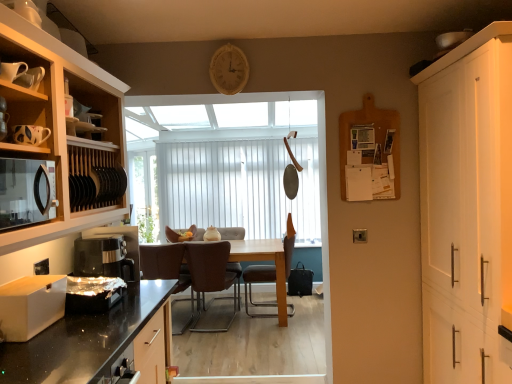
Question: From a real-world perspective, is black matte microwave at left on white vertical blinds at center?

Choices:
 (A) no
 (B) yes

Answer: (B)

Question: Does black matte microwave at left contain white vertical blinds at center?

Choices:
 (A) yes
 (B) no

Answer: (B)

Question: Can you confirm if black matte microwave at left is smaller than white vertical blinds at center?

Choices:
 (A) no
 (B) yes

Answer: (B)

Question: From the image's perspective, is black matte microwave at left beneath white vertical blinds at center?

Choices:
 (A) no
 (B) yes

Answer: (B)

Question: From the image's perspective, is black matte microwave at left above white vertical blinds at center?

Choices:
 (A) no
 (B) yes

Answer: (A)

Question: From a real-world perspective, is white vertical blinds at center above or below brown leather chair at center, arranged as the 3th chair when viewed from the right?

Choices:
 (A) below
 (B) above

Answer: (B)

Question: Is white vertical blinds at center taller or shorter than brown leather chair at center, arranged as the 3th chair when viewed from the right?

Choices:
 (A) short
 (B) tall

Answer: (B)

Question: Choose the correct answer: Is white vertical blinds at center inside brown leather chair at center, marked as the first chair in a left-to-right arrangement, or outside it?

Choices:
 (A) outside
 (B) inside

Answer: (A)

Question: In terms of size, does white vertical blinds at center appear bigger or smaller than brown leather chair at center, arranged as the 3th chair when viewed from the right?

Choices:
 (A) big
 (B) small

Answer: (A)

Question: In terms of size, does brown leather chair at center, marked as the 1th chair in a right-to-left arrangement, appear bigger or smaller than wooden clock at upper center?

Choices:
 (A) big
 (B) small

Answer: (A)

Question: Which is correct: brown leather chair at center, marked as the 1th chair in a right-to-left arrangement, is inside wooden clock at upper center, or outside of it?

Choices:
 (A) inside
 (B) outside

Answer: (B)

Question: Does point click(x=268, y=276) appear closer or farther from the camera than point click(x=226, y=56)?

Choices:
 (A) farther
 (B) closer

Answer: (A)

Question: From the image's perspective, is brown leather chair at center, the third chair from the left, located above or below wooden clock at upper center?

Choices:
 (A) below
 (B) above

Answer: (A)

Question: Based on their positions, is brown leather chair at center, marked as the first chair in a left-to-right arrangement, located to the left or right of brown leather chair at center, the third chair from the left?

Choices:
 (A) right
 (B) left

Answer: (B)

Question: Considering the positions of brown leather chair at center, marked as the first chair in a left-to-right arrangement, and brown leather chair at center, marked as the 1th chair in a right-to-left arrangement, in the image, is brown leather chair at center, marked as the first chair in a left-to-right arrangement, bigger or smaller than brown leather chair at center, marked as the 1th chair in a right-to-left arrangement,?

Choices:
 (A) small
 (B) big

Answer: (A)